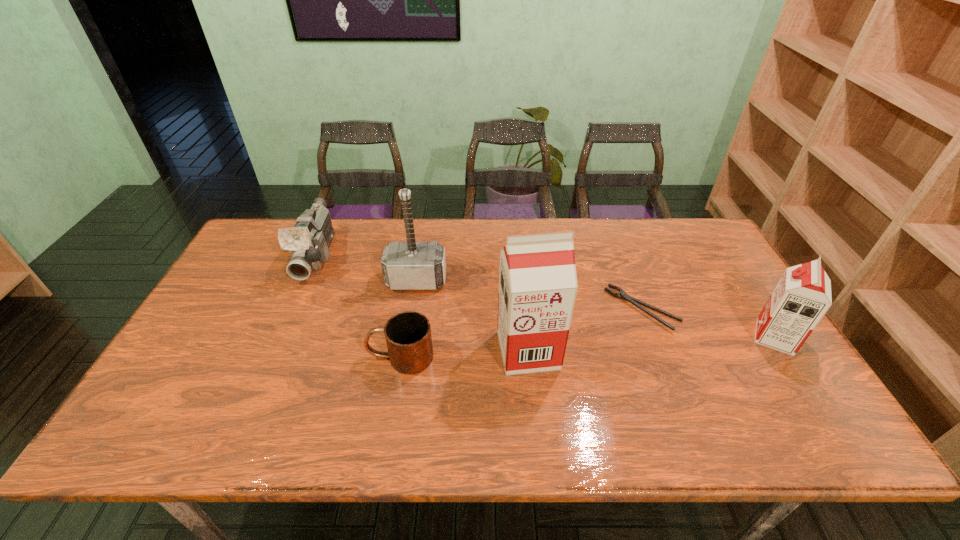
The image size is (960, 540). Find the location of `vacant region at the far edge of the desktop`. vacant region at the far edge of the desktop is located at coordinates (483, 229).

At what (x,y) coordinates should I click in order to perform the action: click on free space at the near edge. Please return your answer as a coordinate pair (x, y). This screenshot has width=960, height=540. Looking at the image, I should click on (588, 404).

Where is `free spot at the left edge of the desktop`? The width and height of the screenshot is (960, 540). free spot at the left edge of the desktop is located at coordinates tap(226, 306).

This screenshot has width=960, height=540. What are the coordinates of `free region at the right edge of the desktop` in the screenshot? It's located at (721, 314).

Locate an element on the screen. The image size is (960, 540). vacant space at the near right corner of the desktop is located at coordinates (746, 390).

Image resolution: width=960 pixels, height=540 pixels. In order to click on vacant space that is in between the fourth tallest object and the second object from right to left in this screenshot , I will do `click(480, 282)`.

This screenshot has height=540, width=960. Identify the location of vacant space that's between the mug and the camcorder. (359, 306).

You are a GUI agent. You are given a task and a screenshot of the screen. Output one action in this format:
    pyautogui.click(x=<x>, y=<y>)
    Task: Click on the vacant area between the leftmost object and the left soya milk
    
    Given the screenshot: What is the action you would take?
    pyautogui.click(x=422, y=303)

Where is `free space between the right soya milk and the mug`? The height and width of the screenshot is (540, 960). free space between the right soya milk and the mug is located at coordinates (588, 347).

Locate an element on the screen. free spot between the camcorder and the hammer is located at coordinates (367, 268).